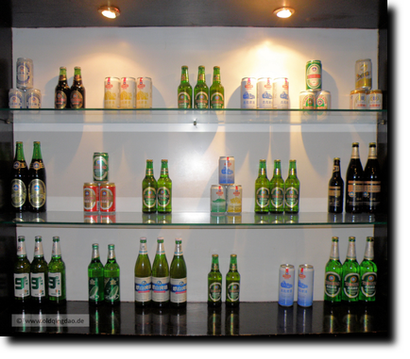
Locate an element on the screen. The height and width of the screenshot is (359, 410). cabinet backdrop is located at coordinates (261, 241).